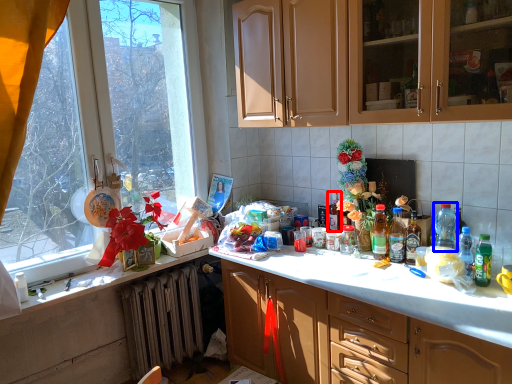
Question: Which of the following is the farthest to the observer, bottle (highlighted by a red box) or bottle (highlighted by a blue box)?

Choices:
 (A) bottle
 (B) bottle

Answer: (A)